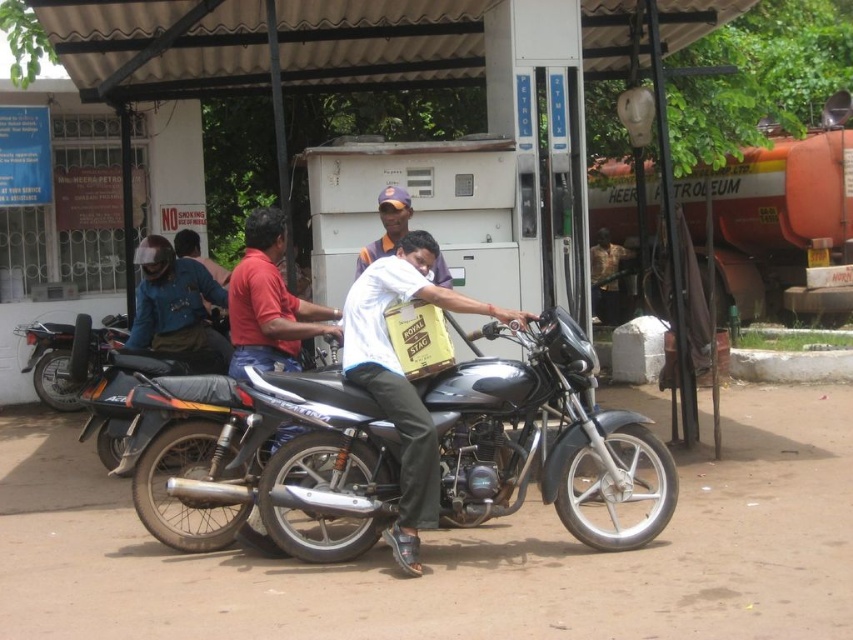
Question: Can you confirm if shiny black motorcycle at center is smaller than black matte motorcycle at left?

Choices:
 (A) yes
 (B) no

Answer: (B)

Question: Can you confirm if white matte shirt at center is wider than white cotton shirt at center?

Choices:
 (A) yes
 (B) no

Answer: (A)

Question: Does shiny black motorcycle at center appear on the left side of white cotton shirt at center?

Choices:
 (A) yes
 (B) no

Answer: (B)

Question: Which point is closer to the camera taking this photo?

Choices:
 (A) (370, 344)
 (B) (74, 394)
 (C) (384, 248)
 (D) (190, 330)

Answer: (A)

Question: Which point is closer to the camera?

Choices:
 (A) black matte motorcycle at left
 (B) shiny black motorcycle at center
 (C) white cotton shirt at center
 (D) matte black helmet at left

Answer: (B)

Question: Which is nearer to the shiny black motorcycle at center?

Choices:
 (A) white cotton shirt at center
 (B) matte black helmet at left
 (C) white matte shirt at center

Answer: (C)